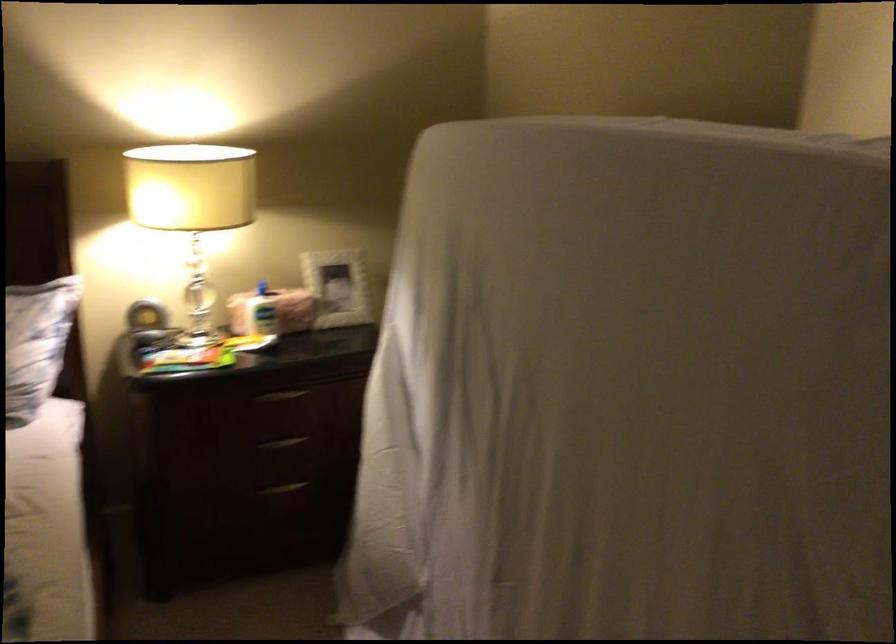
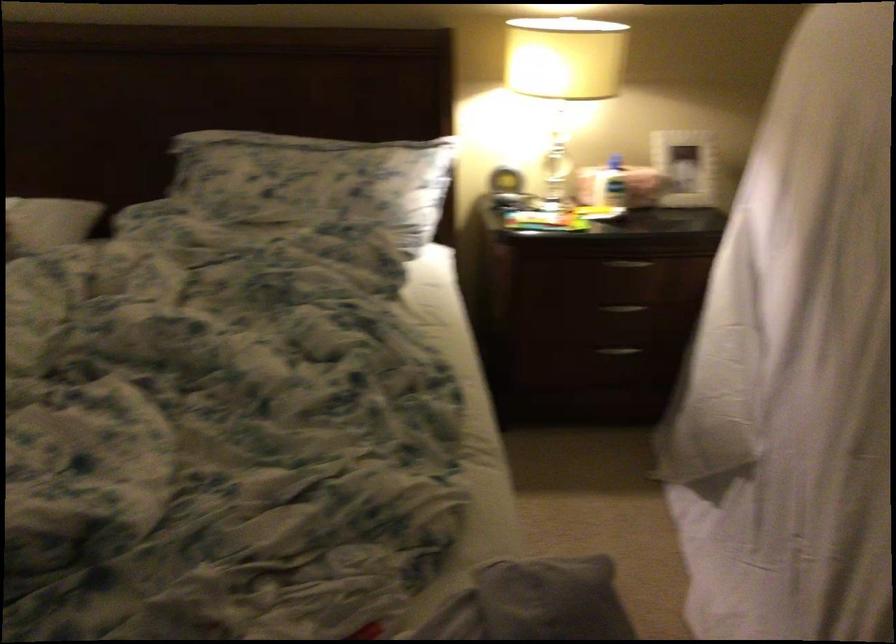
In the second image, find the point that corresponds to (334,292) in the first image.

(684, 167)